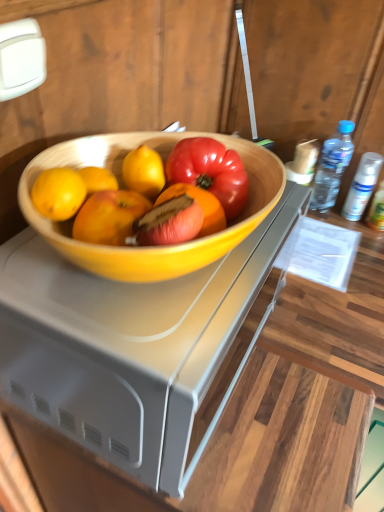
Question: Is white matte spray can at right, which is the 2th bottle in left-to-right order, situated inside wooden desk at center or outside?

Choices:
 (A) outside
 (B) inside

Answer: (A)

Question: Is point (360, 182) positioned closer to the camera than point (13, 406)?

Choices:
 (A) closer
 (B) farther

Answer: (B)

Question: Based on their relative distances, which object is nearer to the transparent plastic bottle at right, the 1th bottle when ordered from left to right?

Choices:
 (A) wooden desk at center
 (B) white matte spray can at right, acting as the second bottle starting from the right
 (C) clear plastic spray can at upper right, the 3th bottle when ordered from left to right

Answer: (B)

Question: Which of these objects is positioned closest to the clear plastic spray can at upper right, the 3th bottle when ordered from left to right?

Choices:
 (A) white matte spray can at right, which is the 2th bottle in left-to-right order
 (B) wooden desk at center
 (C) transparent plastic bottle at right, the 1th bottle when ordered from left to right

Answer: (A)